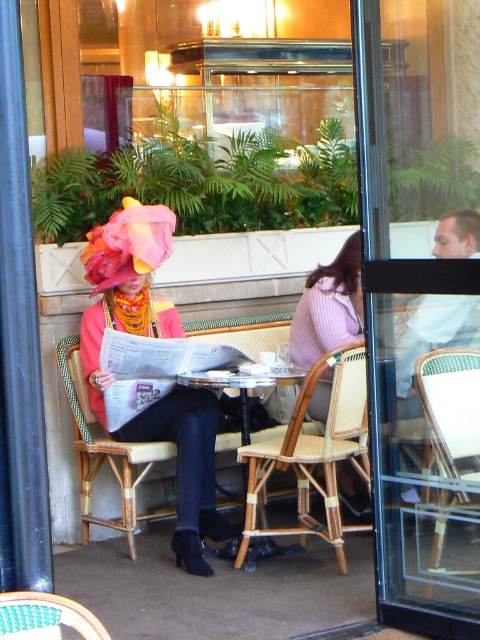
Is matte pink fabric hat at center above woven wood chair at left?

Yes, matte pink fabric hat at center is above woven wood chair at left.

Can you confirm if matte pink fabric hat at center is positioned below woven wood chair at left?

No.

Which is in front, point (129, 292) or point (154, 451)?

Point (154, 451) is more forward.

This screenshot has height=640, width=480. I want to click on matte pink fabric hat at center, so click(x=124, y=285).

Which is more to the right, woven wood chair at center or wooden table at center?

From the viewer's perspective, woven wood chair at center appears more on the right side.

Does point (467, 381) come farther from viewer compared to point (264, 413)?

No, (467, 381) is closer to viewer.

Find the location of a particular element. The height and width of the screenshot is (640, 480). woven wood chair at center is located at coordinates (451, 406).

In the scene shown: Does woven rattan chair at center have a lesser width compared to woven wood chair at center?

Incorrect, woven rattan chair at center's width is not less than woven wood chair at center's.

Is woven rattan chair at center shorter than woven wood chair at center?

No.

Is point (335, 451) less distant than point (466, 493)?

No, (335, 451) is further to viewer.

Where is `woven rattan chair at center`? woven rattan chair at center is located at coordinates (314, 452).